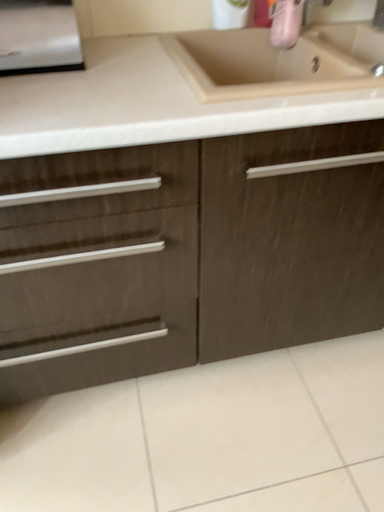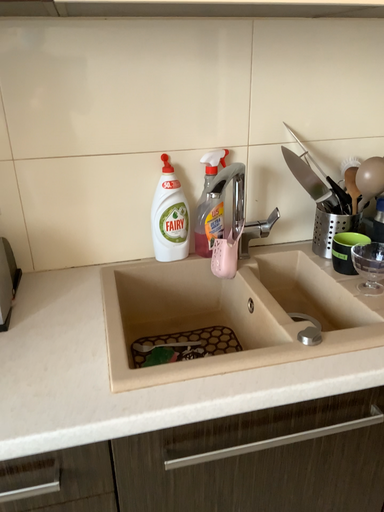
Question: Which way did the camera rotate in the video?

Choices:
 (A) rotated downward
 (B) rotated upward

Answer: (B)